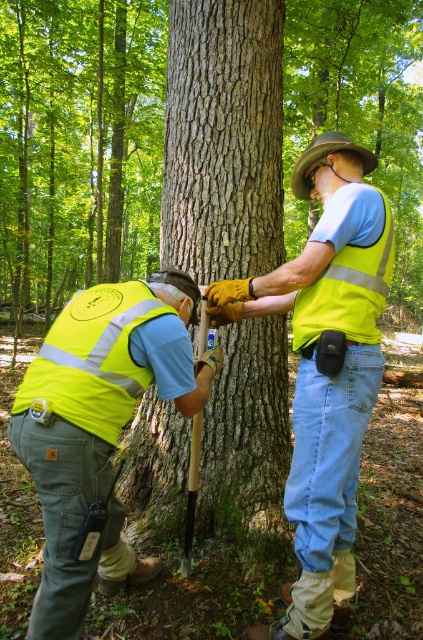
Question: Is rough bark tree at center wider than yellow reflective vest at center?

Choices:
 (A) yes
 (B) no

Answer: (A)

Question: Which object is farther from the camera taking this photo?

Choices:
 (A) high visibility yellow vest at lower left
 (B) smooth bark tree trunk at center
 (C) brown fabric cowboy hat at upper center

Answer: (B)

Question: Which of the following is the farthest from the observer?

Choices:
 (A) (359, 161)
 (B) (84, 353)
 (C) (76, 532)

Answer: (A)

Question: From the image, what is the correct spatial relationship of smooth bark tree trunk at center in relation to high visibility yellow safety vest at center?

Choices:
 (A) below
 (B) above

Answer: (B)

Question: Does rough bark tree at center appear over brown fabric cowboy hat at upper center?

Choices:
 (A) no
 (B) yes

Answer: (B)

Question: Among these objects, which one is nearest to the camera?

Choices:
 (A) smooth bark tree trunk at center
 (B) brown fabric cowboy hat at upper center
 (C) high visibility yellow safety vest at center

Answer: (C)